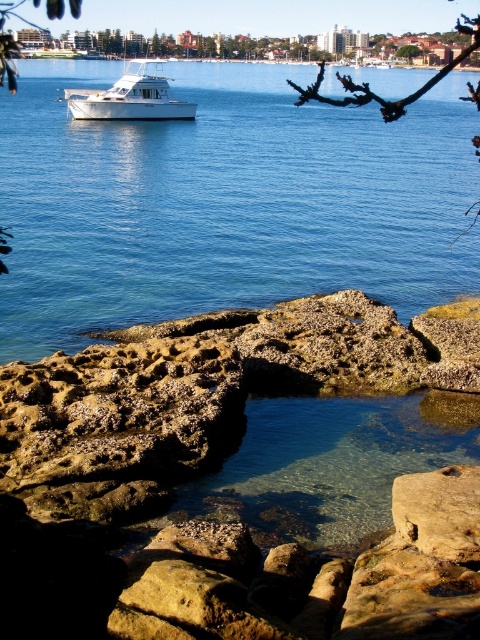
Question: Which point appears farthest from the camera in this image?

Choices:
 (A) (465, 58)
 (B) (420, 51)
 (C) (172, 221)
 (D) (446, 468)

Answer: (B)

Question: Is the position of brown rough rock at lower right more distant than that of green leafy tree at upper center?

Choices:
 (A) yes
 (B) no

Answer: (B)

Question: Can you confirm if clear water at center is positioned to the left of brown textured branch at upper center?

Choices:
 (A) no
 (B) yes

Answer: (B)

Question: Which point is closer to the camera?

Choices:
 (A) clear water at center
 (B) green leafy tree at upper center

Answer: (A)

Question: Which point is farther to the camera?

Choices:
 (A) brown textured branch at upper center
 (B) brown rough rock at lower right
 (C) clear water at center
 (D) white matte boat at upper left

Answer: (D)

Question: From the image, what is the correct spatial relationship of brown textured branch at upper center in relation to green leafy tree at upper center?

Choices:
 (A) left
 (B) right

Answer: (A)